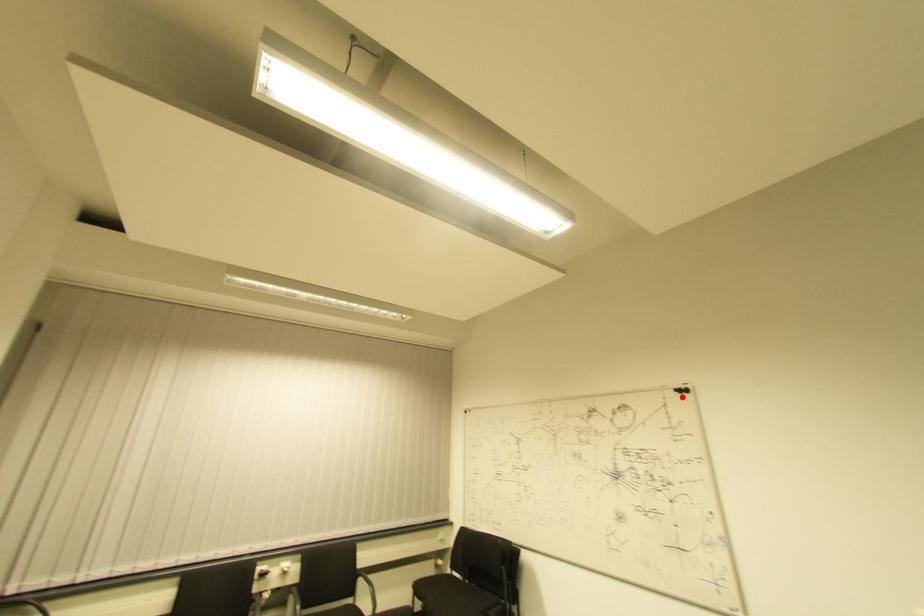
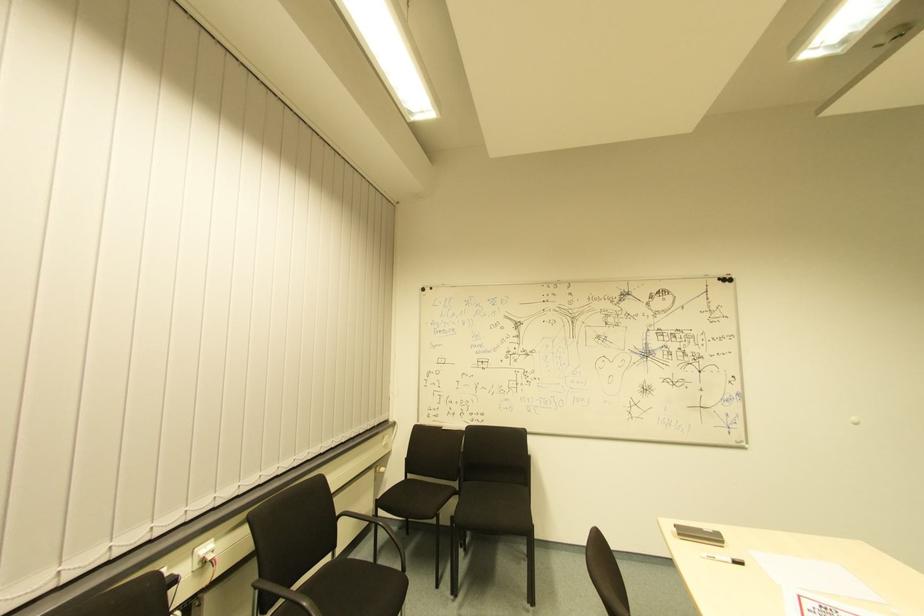
In the second image, find the point that corresponds to the highlighted location in the first image.

(725, 286)